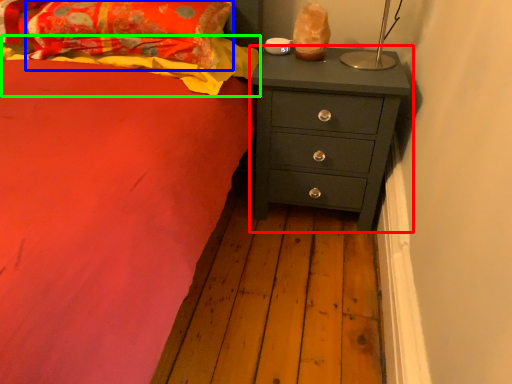
Question: Based on their relative distances, which object is nearer to chest of drawers (highlighted by a red box)? Choose from pillow (highlighted by a blue box) and blanket (highlighted by a green box).

Choices:
 (A) pillow
 (B) blanket

Answer: (B)